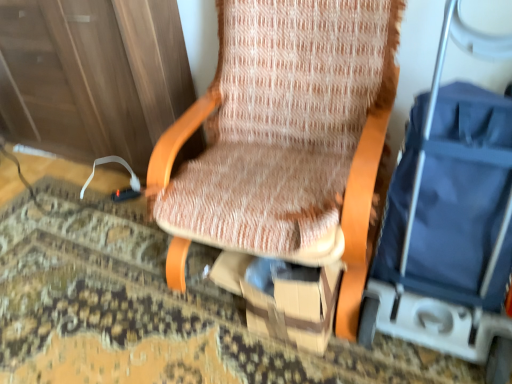
Question: Could you tell me if brown cardboard box at center is facing textured fabric chair at center?

Choices:
 (A) no
 (B) yes

Answer: (B)

Question: Considering the relative positions of brown cardboard box at center and textured fabric chair at center in the image provided, is brown cardboard box at center to the right of textured fabric chair at center from the viewer's perspective?

Choices:
 (A) yes
 (B) no

Answer: (B)

Question: Is brown cardboard box at center in contact with textured fabric chair at center?

Choices:
 (A) no
 (B) yes

Answer: (A)

Question: Is brown cardboard box at center taller than textured fabric chair at center?

Choices:
 (A) yes
 (B) no

Answer: (B)

Question: Is brown cardboard box at center facing away from textured fabric chair at center?

Choices:
 (A) no
 (B) yes

Answer: (B)

Question: From the image's perspective, is blue fabric baby carriage at right located above or below brown cardboard box at center?

Choices:
 (A) below
 (B) above

Answer: (B)

Question: Is blue fabric baby carriage at right to the left or to the right of brown cardboard box at center in the image?

Choices:
 (A) left
 (B) right

Answer: (B)

Question: Choose the correct answer: Is blue fabric baby carriage at right inside brown cardboard box at center or outside it?

Choices:
 (A) inside
 (B) outside

Answer: (B)

Question: From a real-world perspective, is blue fabric baby carriage at right above or below brown cardboard box at center?

Choices:
 (A) above
 (B) below

Answer: (A)

Question: Would you say blue fabric baby carriage at right is inside or outside textured fabric chair at center?

Choices:
 (A) inside
 (B) outside

Answer: (B)

Question: From the image's perspective, relative to textured fabric chair at center, is blue fabric baby carriage at right above or below?

Choices:
 (A) above
 (B) below

Answer: (B)

Question: From their relative heights in the image, would you say blue fabric baby carriage at right is taller or shorter than textured fabric chair at center?

Choices:
 (A) tall
 (B) short

Answer: (A)

Question: From a real-world perspective, is blue fabric baby carriage at right physically located above or below textured fabric chair at center?

Choices:
 (A) above
 (B) below

Answer: (A)

Question: From their relative heights in the image, would you say brown cardboard box at center is taller or shorter than blue fabric baby carriage at right?

Choices:
 (A) short
 (B) tall

Answer: (A)

Question: From a real-world perspective, is brown cardboard box at center above or below blue fabric baby carriage at right?

Choices:
 (A) below
 (B) above

Answer: (A)